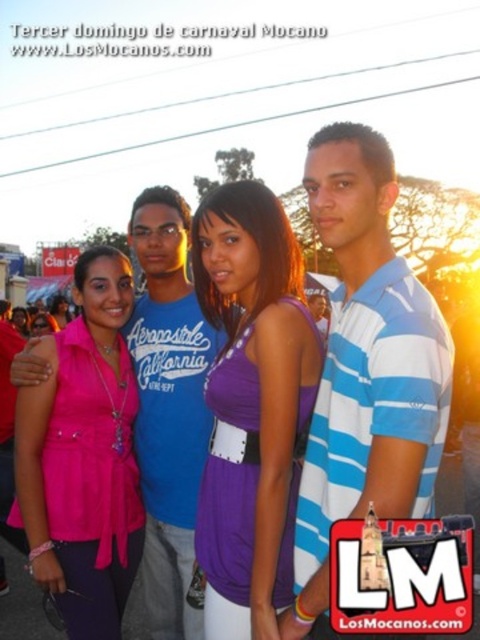
You are a photographer at the carnival event. You need to adjust the lighting to ensure both the matte pink blouse at center and the pink fabric shirt at center are visible. Which one requires more lighting adjustment because it is smaller?

The matte pink blouse at center has a smaller size compared to the pink fabric shirt at center, so it requires more lighting adjustment to ensure visibility.

You are a photographer adjusting the camera settings for a group photo. The blue striped polo shirt at center and the pink fabric shirt at center are both in the frame. Which shirt should you focus on if you want to capture the wider object in the scene?

The pink fabric shirt at center is wider than the blue striped polo shirt at center, so you should focus on the pink fabric shirt at center to capture the wider object in the scene.